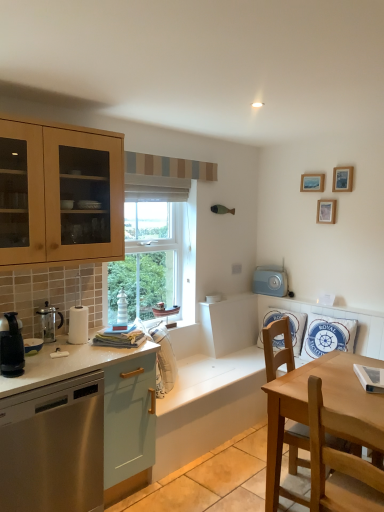
Question: From a real-world perspective, is stainless steel dishwasher at left positioned under black plastic coffee maker at left, arranged as the second kitchen appliance when viewed from the back, based on gravity?

Choices:
 (A) no
 (B) yes

Answer: (B)

Question: Is stainless steel dishwasher at left facing away from black plastic coffee maker at left, the 1th kitchen appliance from the front?

Choices:
 (A) no
 (B) yes

Answer: (A)

Question: Is stainless steel dishwasher at left not within black plastic coffee maker at left, the 1th kitchen appliance from the front?

Choices:
 (A) no
 (B) yes

Answer: (B)

Question: Is stainless steel dishwasher at left next to black plastic coffee maker at left, arranged as the second kitchen appliance when viewed from the back, and touching it?

Choices:
 (A) no
 (B) yes

Answer: (A)

Question: Is stainless steel dishwasher at left positioned in front of black plastic coffee maker at left, arranged as the second kitchen appliance when viewed from the back?

Choices:
 (A) no
 (B) yes

Answer: (B)

Question: Is white fabric pillow at center, the 2th appliance when ordered from left to right, taller or shorter than wooden picture frame at upper right, positioned as the 3th picture frame in bottom-to-top order?

Choices:
 (A) short
 (B) tall

Answer: (B)

Question: From the image's perspective, is white fabric pillow at center, the second appliance when ordered from right to left, positioned above or below wooden picture frame at upper right, arranged as the first picture frame when viewed from the top?

Choices:
 (A) below
 (B) above

Answer: (A)

Question: Is white fabric pillow at center, the 3th appliance positioned from the back, bigger or smaller than wooden picture frame at upper right, positioned as the 3th picture frame in bottom-to-top order?

Choices:
 (A) big
 (B) small

Answer: (A)

Question: Is white fabric pillow at center, the 3th appliance positioned from the back, in front of or behind wooden picture frame at upper right, arranged as the first picture frame when viewed from the top, in the image?

Choices:
 (A) behind
 (B) front

Answer: (B)

Question: Considering the positions of black plastic coffee maker at left, the 1th kitchen appliance from the front, and white striped lighthouse at window, the second appliance when ordered from front to back, in the image, is black plastic coffee maker at left, the 1th kitchen appliance from the front, wider or thinner than white striped lighthouse at window, the second appliance when ordered from front to back,?

Choices:
 (A) wide
 (B) thin

Answer: (A)

Question: In the image, is black plastic coffee maker at left, arranged as the second kitchen appliance when viewed from the back, positioned in front of or behind white striped lighthouse at window, the second appliance when ordered from front to back?

Choices:
 (A) front
 (B) behind

Answer: (A)

Question: Would you say black plastic coffee maker at left, the 1th kitchen appliance from the front, is inside or outside white striped lighthouse at window, which is counted as the 1th appliance, starting from the left?

Choices:
 (A) inside
 (B) outside

Answer: (B)

Question: Based on their sizes in the image, would you say black plastic coffee maker at left, the 1th kitchen appliance from the front, is bigger or smaller than white striped lighthouse at window, which is counted as the 1th appliance, starting from the left?

Choices:
 (A) small
 (B) big

Answer: (B)

Question: Is blue fabric pillow at right, the 1th pillow when ordered from right to left, to the left or to the right of wooden picture frame at upper right, placed as the 2th picture frame when sorted from top to bottom, in the image?

Choices:
 (A) left
 (B) right

Answer: (A)

Question: Is blue fabric pillow at right, acting as the second pillow starting from the left, wider or thinner than wooden picture frame at upper right, placed as the 2th picture frame when sorted from top to bottom?

Choices:
 (A) thin
 (B) wide

Answer: (B)